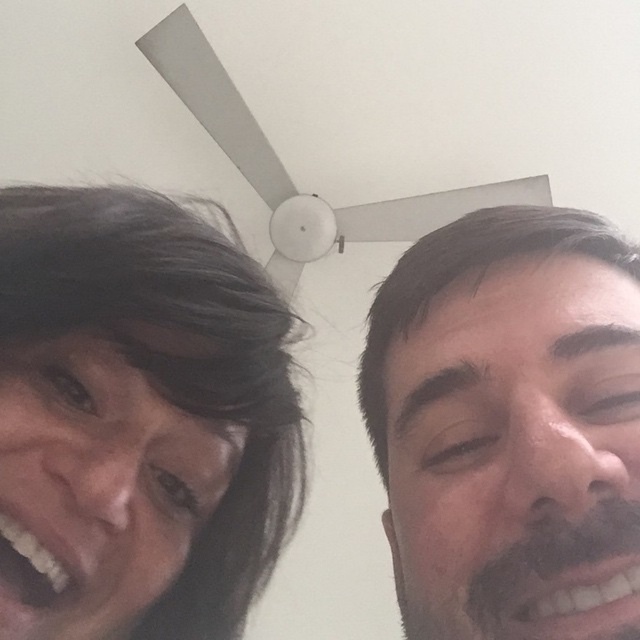
Question: Which point appears farthest from the camera in this image?

Choices:
 (A) (573, 390)
 (B) (177, 253)

Answer: (B)

Question: Which object appears farthest from the camera in this image?

Choices:
 (A) smooth skin face at right
 (B) matte black hair at upper center
 (C) dark brown hair at left

Answer: (C)

Question: Can you confirm if matte black hair at upper center is smaller than dark brown hair at left?

Choices:
 (A) yes
 (B) no

Answer: (B)

Question: Does matte black hair at upper center appear on the right side of smooth skin face at right?

Choices:
 (A) no
 (B) yes

Answer: (A)

Question: Based on their relative distances, which object is farther from the dark brown hair at left?

Choices:
 (A) smooth skin face at right
 (B) matte black hair at upper center

Answer: (A)

Question: From the image, what is the correct spatial relationship of dark brown hair at left in relation to smooth skin face at right?

Choices:
 (A) left
 (B) right

Answer: (A)